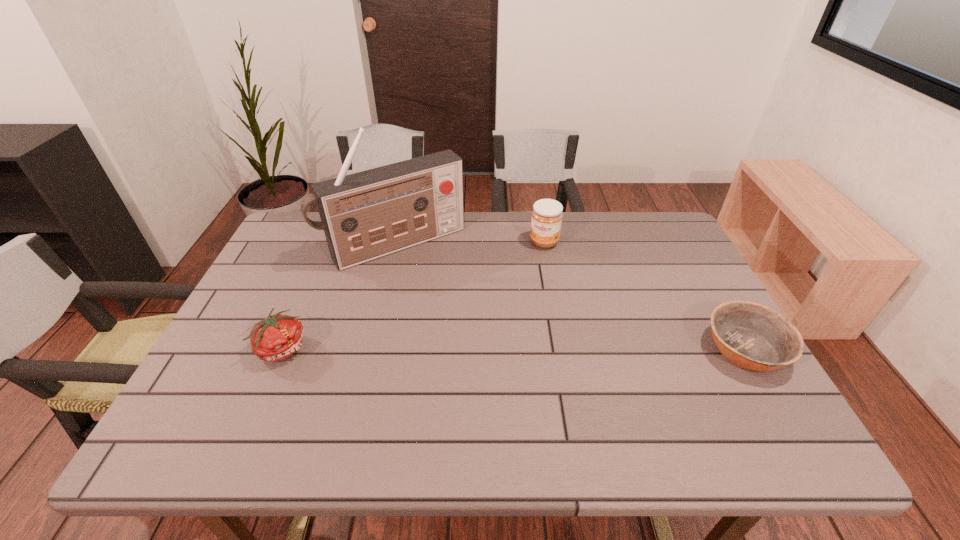
You are a GUI agent. You are given a task and a screenshot of the screen. Output one action in this format:
    pyautogui.click(x=<x>, y=<y>)
    Task: Click on the vacant space on the desktop that is between the tomato and the shortest object and is positioned on the front label of the third object from left to right
    This screenshot has width=960, height=540.
    Given the screenshot: What is the action you would take?
    [501, 349]

Where is `vacant space on the desktop that is between the second shortest object and the bowl and is positioned on the front panel of the radio receiver`? Image resolution: width=960 pixels, height=540 pixels. vacant space on the desktop that is between the second shortest object and the bowl and is positioned on the front panel of the radio receiver is located at coordinates (475, 349).